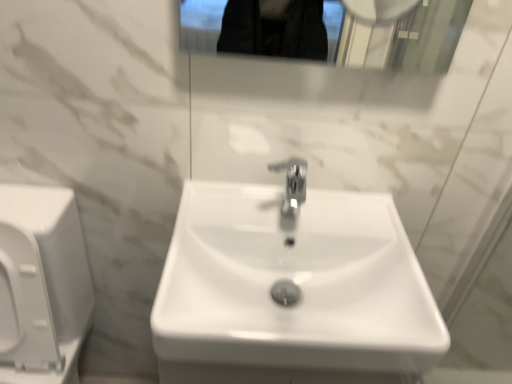
Question: Is white glossy sink at center bigger or smaller than white glossy toilet at left?

Choices:
 (A) small
 (B) big

Answer: (A)

Question: Relative to white glossy toilet at left, is white glossy sink at center in front or behind?

Choices:
 (A) front
 (B) behind

Answer: (B)

Question: Is white glossy sink at center wider or thinner than white glossy toilet at left?

Choices:
 (A) wide
 (B) thin

Answer: (B)

Question: From the image's perspective, is white glossy toilet at left above or below white glossy sink at center?

Choices:
 (A) above
 (B) below

Answer: (B)

Question: Is point (76, 309) positioned closer to the camera than point (402, 254)?

Choices:
 (A) closer
 (B) farther

Answer: (B)

Question: Is white glossy toilet at left taller or shorter than white glossy sink at center?

Choices:
 (A) short
 (B) tall

Answer: (B)

Question: Is white glossy toilet at left bigger or smaller than white glossy sink at center?

Choices:
 (A) small
 (B) big

Answer: (B)